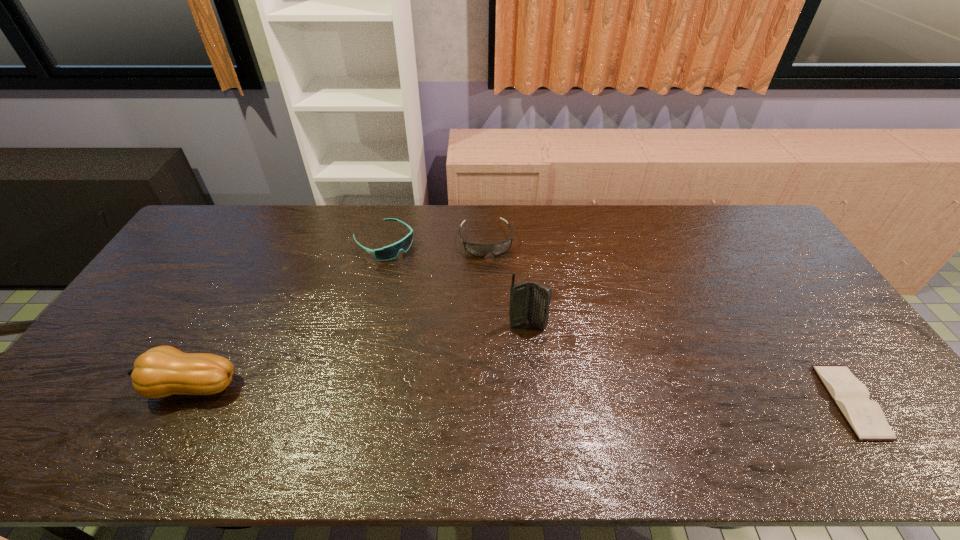
The height and width of the screenshot is (540, 960). I want to click on the second closest object to the sunglasses, so click(x=529, y=301).

Locate which object ranks third in proximity to the shortest object. Please provide its 2D coordinates. Your answer should be formatted as a tuple, i.e. [(x, y)], where the tuple contains the x and y coordinates of a point satisfying the conditions above.

[(389, 252)]

Locate an element on the screen. vacant point that satisfies the following two spatial constraints: 1. on the front side of the fourth object from right to left; 2. on the right side of the third farthest object is located at coordinates (364, 325).

At what (x,y) coordinates should I click in order to perform the action: click on vacant area in the image that satisfies the following two spatial constraints: 1. on the front side of the diary; 2. on the left side of the cellular telephone. Please return your answer as a coordinate pair (x, y). This screenshot has width=960, height=540. Looking at the image, I should click on 535,401.